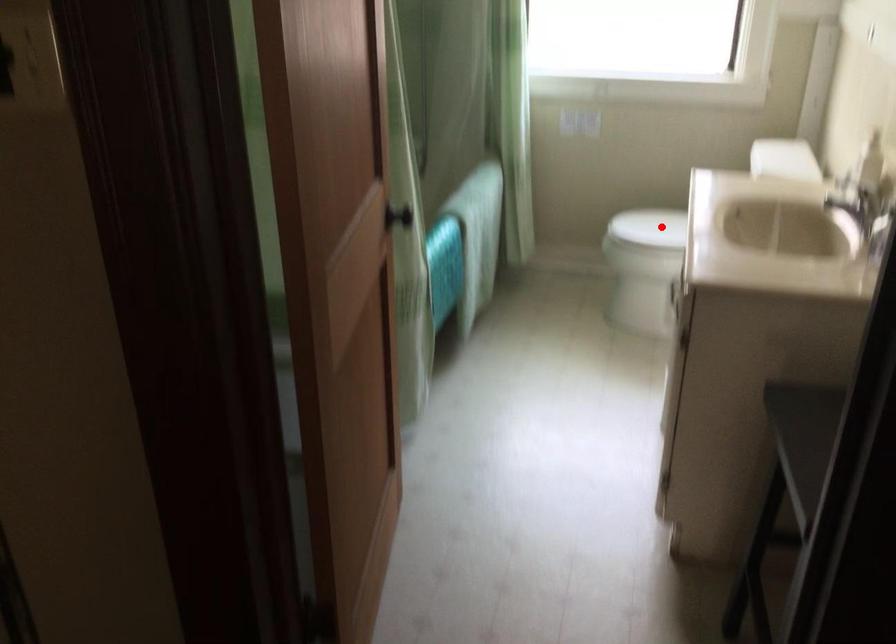
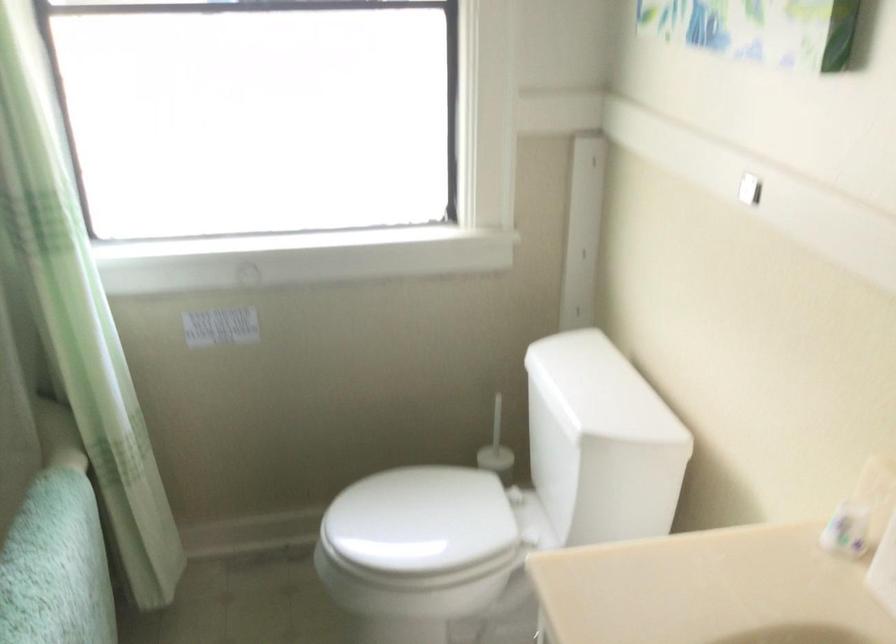
In the second image, find the point that corresponds to the highlighted location in the first image.

(419, 526)